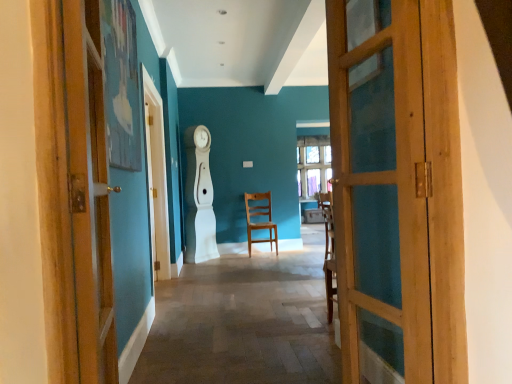
Question: Is wooden chair at center not close to wooden door at right, marked as the second door in a left-to-right arrangement?

Choices:
 (A) yes
 (B) no

Answer: (A)

Question: From the image's perspective, is wooden chair at center below wooden door at right, marked as the second door in a left-to-right arrangement?

Choices:
 (A) yes
 (B) no

Answer: (A)

Question: Is wooden chair at center thinner than wooden door at right, marked as the second door in a left-to-right arrangement?

Choices:
 (A) no
 (B) yes

Answer: (A)

Question: Can you confirm if wooden chair at center is smaller than wooden door at right, the 1th door viewed from the right?

Choices:
 (A) no
 (B) yes

Answer: (A)

Question: From a real-world perspective, does wooden chair at center stand above wooden door at right, marked as the second door in a left-to-right arrangement?

Choices:
 (A) no
 (B) yes

Answer: (A)

Question: Would you say wooden door at right, marked as the second door in a left-to-right arrangement, is to the left or to the right of wooden chair at center in the picture?

Choices:
 (A) right
 (B) left

Answer: (A)

Question: Considering their positions, is wooden door at right, marked as the second door in a left-to-right arrangement, located in front of or behind wooden chair at center?

Choices:
 (A) front
 (B) behind

Answer: (A)

Question: From a real-world perspective, is wooden door at right, the 1th door viewed from the right, positioned above or below wooden chair at center?

Choices:
 (A) above
 (B) below

Answer: (A)

Question: Considering the positions of wooden door at right, marked as the second door in a left-to-right arrangement, and wooden chair at center in the image, is wooden door at right, marked as the second door in a left-to-right arrangement, bigger or smaller than wooden chair at center?

Choices:
 (A) big
 (B) small

Answer: (B)

Question: Choose the correct answer: Is wooden door at left, the first door viewed from the left, inside wooden chair at center or outside it?

Choices:
 (A) outside
 (B) inside

Answer: (A)

Question: In terms of size, does wooden door at left, the first door viewed from the left, appear bigger or smaller than wooden chair at center?

Choices:
 (A) small
 (B) big

Answer: (A)

Question: In terms of width, does wooden door at left, the first door viewed from the left, look wider or thinner when compared to wooden chair at center?

Choices:
 (A) wide
 (B) thin

Answer: (B)

Question: From a real-world perspective, is wooden door at left, the first door viewed from the left, physically located above or below wooden chair at center?

Choices:
 (A) below
 (B) above

Answer: (B)

Question: Considering the positions of point (248, 248) and point (132, 352), is point (248, 248) closer or farther from the camera than point (132, 352)?

Choices:
 (A) closer
 (B) farther

Answer: (B)

Question: From their relative heights in the image, would you say wooden chair at center is taller or shorter than wooden door at left, positioned as the 2th door in right-to-left order?

Choices:
 (A) tall
 (B) short

Answer: (B)